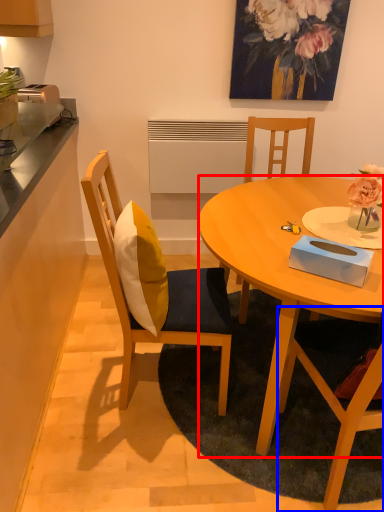
Question: Which object is closer to the camera taking this photo, desk (highlighted by a red box) or chair (highlighted by a blue box)?

Choices:
 (A) desk
 (B) chair

Answer: (B)